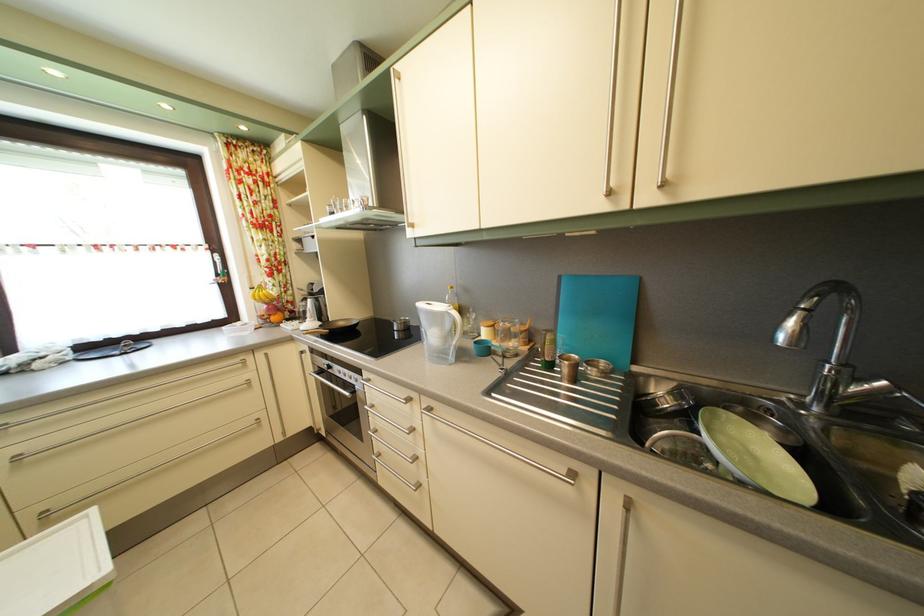
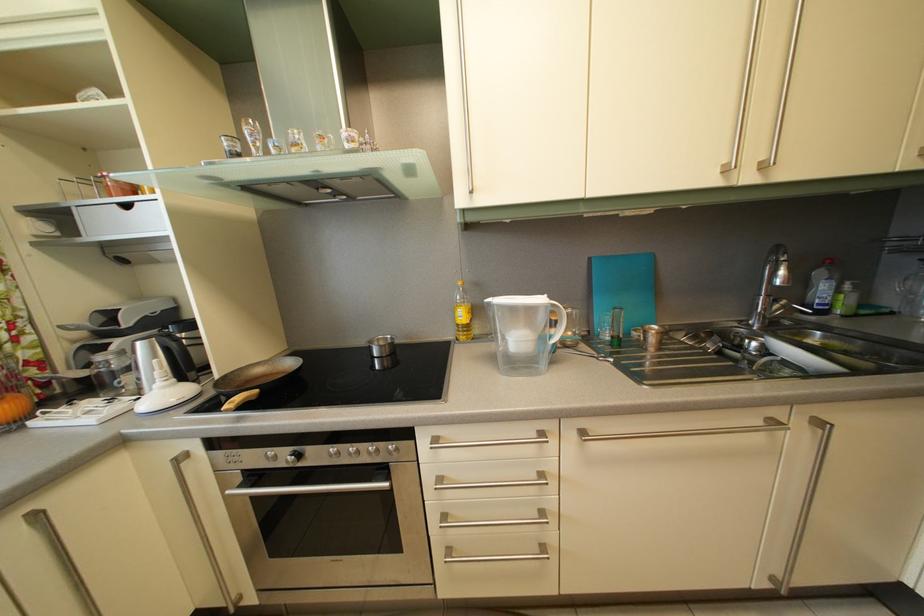
Question: How did the camera likely rotate?

Choices:
 (A) Left
 (B) Right
 (C) Up
 (D) Down

Answer: (B)